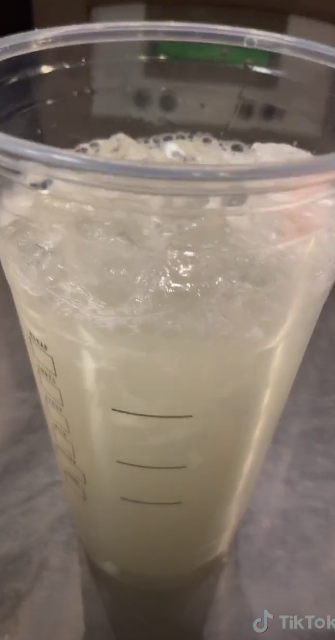
Where is `cup`? This screenshot has width=335, height=640. cup is located at coordinates (224, 486).